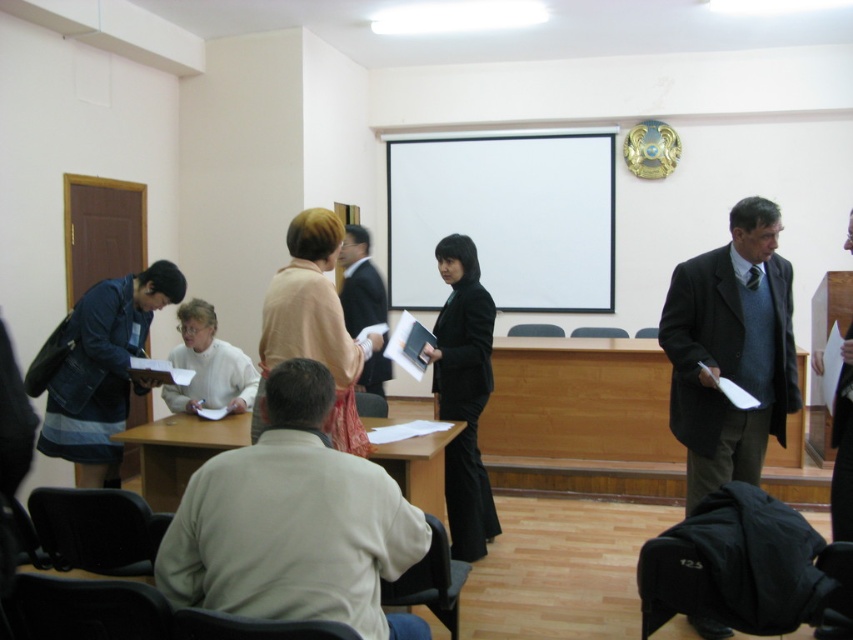
Image resolution: width=853 pixels, height=640 pixels. Describe the element at coordinates (293, 524) in the screenshot. I see `beige fabric jacket at center` at that location.

Is beige fabric jacket at center thinner than dark gray suit at center?

Incorrect, beige fabric jacket at center's width is not less than dark gray suit at center's.

Is point (165, 563) farther from viewer compared to point (834, 632)?

No, it is not.

This screenshot has width=853, height=640. What are the coordinates of `beige fabric jacket at center` in the screenshot? It's located at (293, 524).

How much distance is there between white matte projector screen at upper center and dark blue fabric business suit at center?

A distance of 7.27 feet exists between white matte projector screen at upper center and dark blue fabric business suit at center.

Between white matte projector screen at upper center and dark blue fabric business suit at center, which one has more height?

white matte projector screen at upper center

The height and width of the screenshot is (640, 853). What do you see at coordinates (505, 218) in the screenshot?
I see `white matte projector screen at upper center` at bounding box center [505, 218].

Identify the location of white matte projector screen at upper center. (505, 218).

Is denim skirt at left positioned in front of dark blue fabric business suit at center?

Yes, it is in front of dark blue fabric business suit at center.

Can you confirm if denim skirt at left is taller than dark blue fabric business suit at center?

Indeed, denim skirt at left has a greater height compared to dark blue fabric business suit at center.

Is point (117, 444) farther from viewer compared to point (343, 307)?

No, it is not.

This screenshot has width=853, height=640. Find the location of `denim skirt at left`. denim skirt at left is located at coordinates (102, 369).